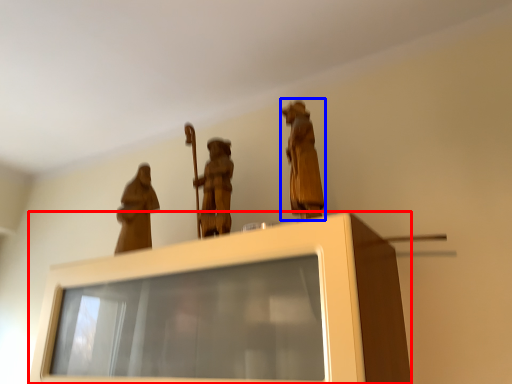
Question: Which point is further to the camera, furniture (highlighted by a red box) or person (highlighted by a blue box)?

Choices:
 (A) furniture
 (B) person

Answer: (B)